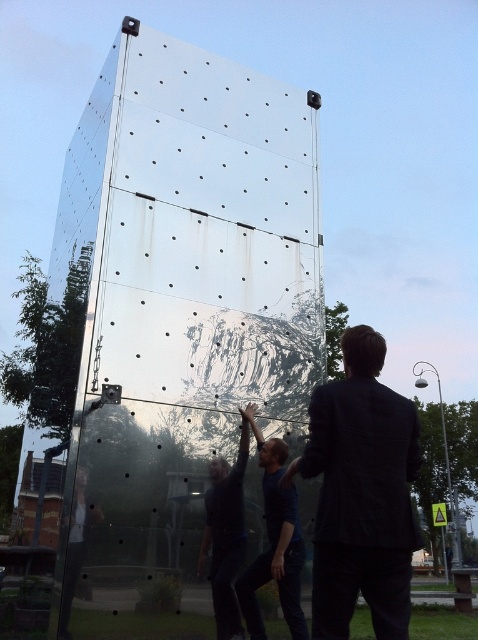
Question: Does transparent glass at center have a larger size compared to dark gray fabric shirt at center?

Choices:
 (A) yes
 (B) no

Answer: (A)

Question: Does transparent glass at center appear under dark suit at center?

Choices:
 (A) yes
 (B) no

Answer: (B)

Question: Which object appears farthest from the camera in this image?

Choices:
 (A) dark gray fabric shirt at center
 (B) dark blue shirt at center
 (C) dark suit at center

Answer: (B)

Question: Does dark suit at center appear over dark gray fabric shirt at center?

Choices:
 (A) yes
 (B) no

Answer: (A)

Question: Which point is closer to the camera?

Choices:
 (A) transparent glass at center
 (B) dark suit at center

Answer: (B)

Question: Which point appears closest to the camera in this image?

Choices:
 (A) (315, 404)
 (B) (107, 438)
 (C) (285, 529)
 (D) (228, 480)

Answer: (A)